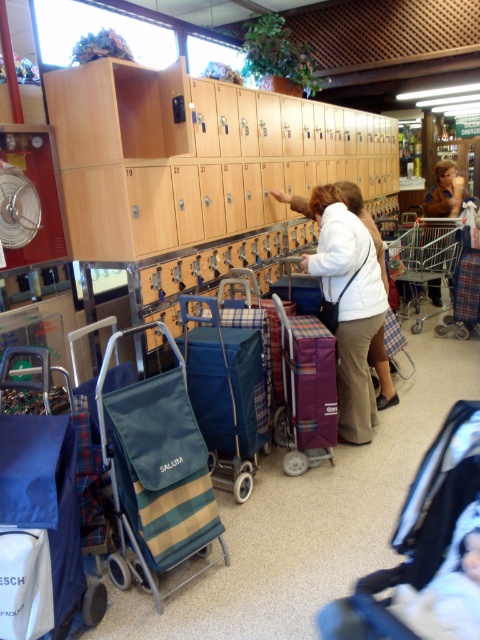
Question: Among these objects, which one is nearest to the camera?

Choices:
 (A) brown plaid skirt at center
 (B) dark blue fabric baby carriage at lower right
 (C) green striped fabric trolley at center

Answer: (B)

Question: Is green striped fabric trolley at center in front of metallic silver trolley at center?

Choices:
 (A) no
 (B) yes

Answer: (B)

Question: Is metallic silver trolley at center above brown plaid skirt at center?

Choices:
 (A) no
 (B) yes

Answer: (A)

Question: Can you confirm if metallic silver trolley at center is wider than brown plaid skirt at center?

Choices:
 (A) no
 (B) yes

Answer: (B)

Question: Among these objects, which one is farthest from the camera?

Choices:
 (A) metallic silver trolley at center
 (B) brown plaid skirt at center
 (C) dark blue fabric baby carriage at lower right
 (D) green striped fabric trolley at center

Answer: (B)

Question: Among these objects, which one is nearest to the camera?

Choices:
 (A) green striped fabric trolley at center
 (B) brown plaid skirt at center

Answer: (A)